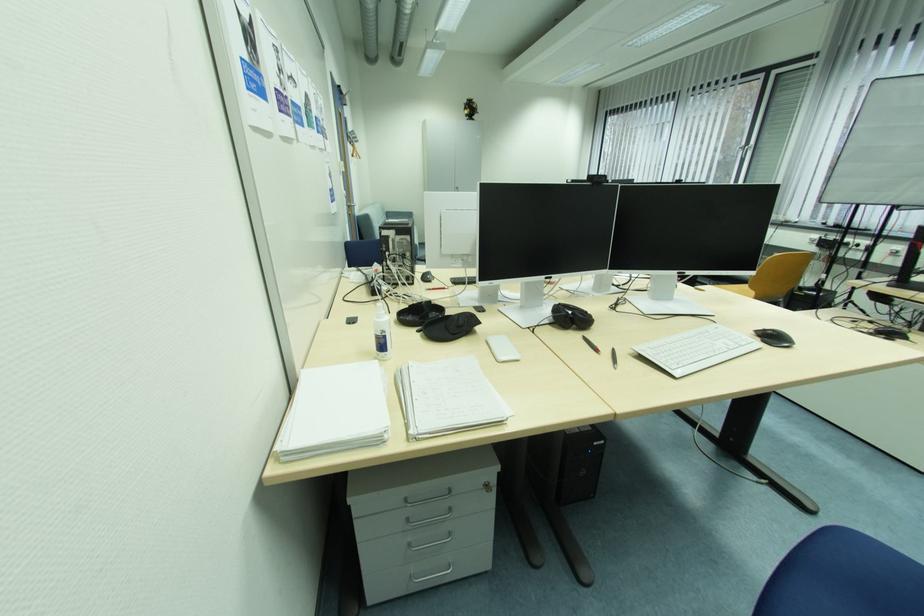
Find where to pull the silver drawer handle. Please return your answer as a coordinate pair (x, y).

(427, 498)